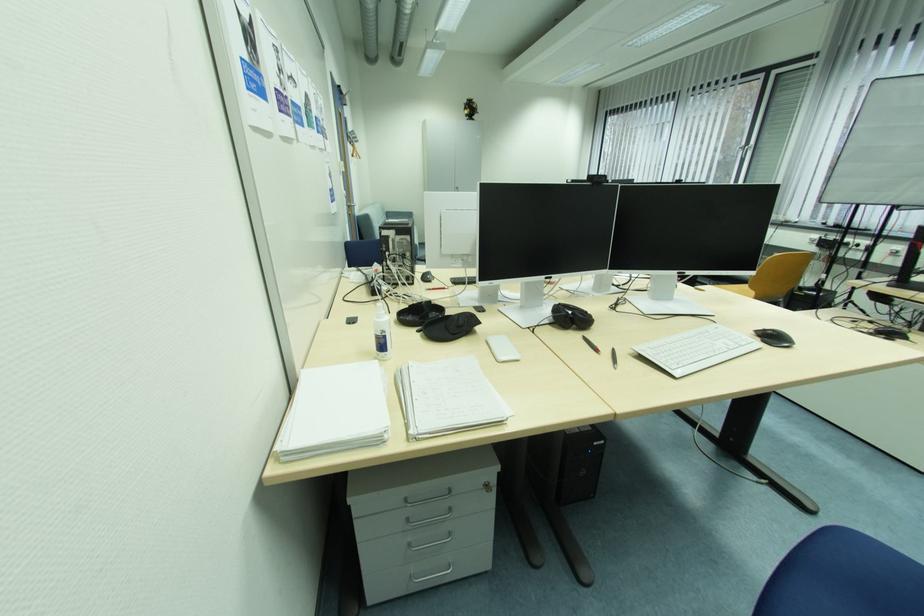
Find where to pull the silver drawer handle. Please return your answer as a coordinate pair (x, y).

(427, 498)